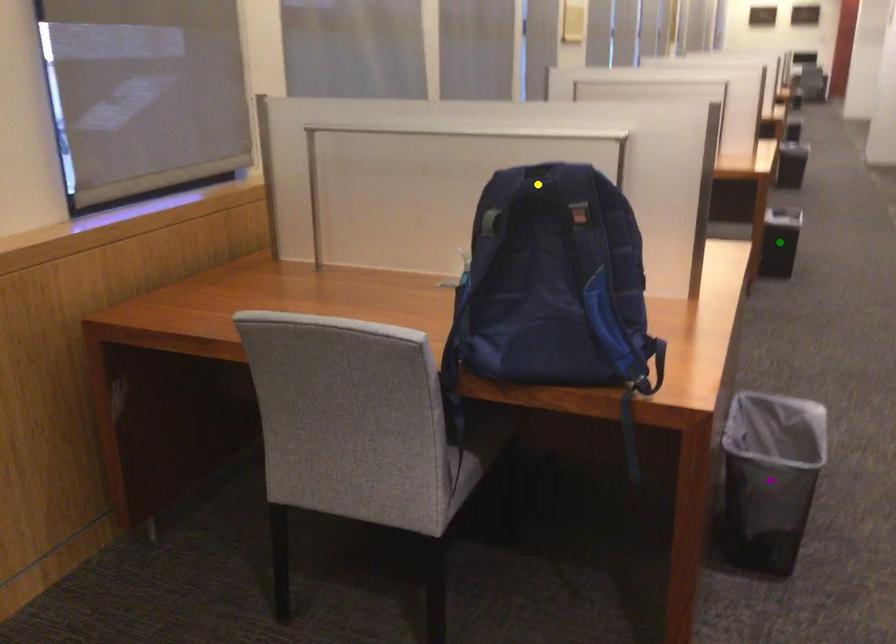
Order these from nearest to farthest:
green point, purple point, yellow point

1. yellow point
2. purple point
3. green point